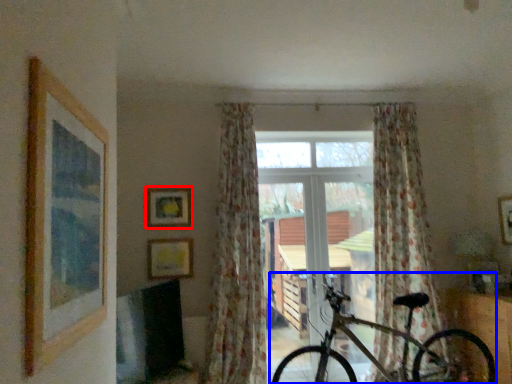
Question: Among these objects, which one is nearest to the camera, picture frame (highlighted by a red box) or bicycle (highlighted by a blue box)?

Choices:
 (A) picture frame
 (B) bicycle

Answer: (B)